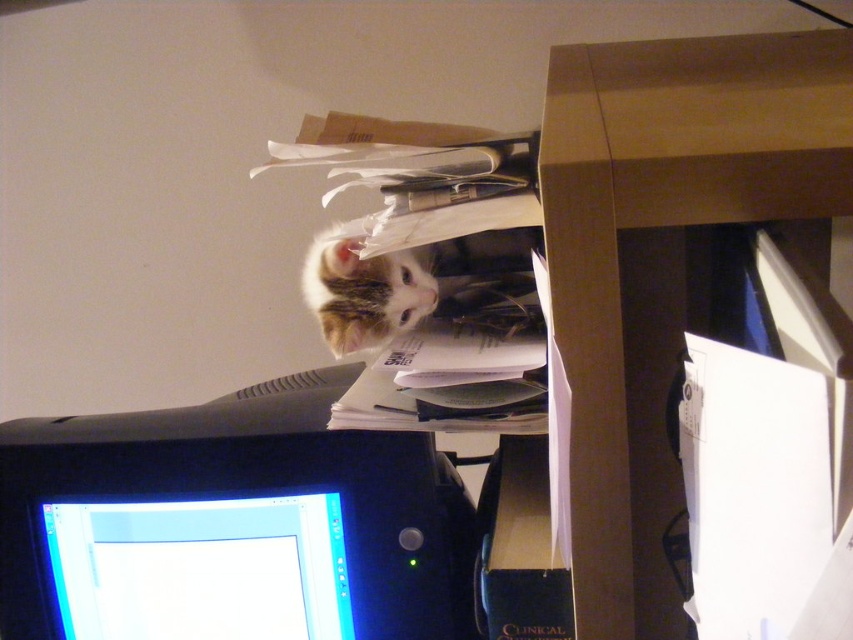
Question: Can you confirm if brown wood computer desk at center is smaller than matte black monitor at lower left?

Choices:
 (A) yes
 (B) no

Answer: (B)

Question: Which point is farther from the camera taking this photo?

Choices:
 (A) (347, 342)
 (B) (160, 529)

Answer: (B)

Question: Among these objects, which one is farthest from the camera?

Choices:
 (A) striped fur cat at upper center
 (B) black plastic monitor at lower left

Answer: (B)

Question: Does matte black monitor at lower left have a larger size compared to striped fur cat at upper center?

Choices:
 (A) yes
 (B) no

Answer: (A)

Question: Which object is closer to the camera taking this photo?

Choices:
 (A) striped fur cat at upper center
 (B) black plastic monitor at lower left
 (C) brown wood computer desk at center

Answer: (C)

Question: Can you confirm if matte black monitor at lower left is smaller than striped fur cat at upper center?

Choices:
 (A) no
 (B) yes

Answer: (A)